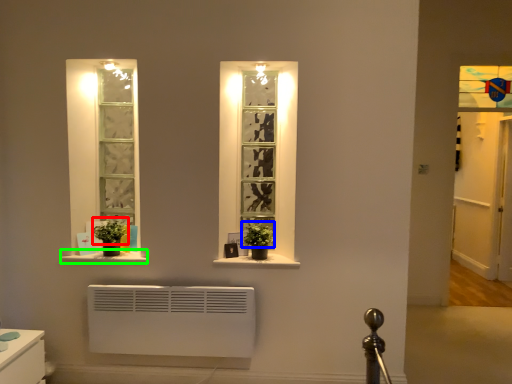
Question: Estimate the real-world distances between objects in this image. Which object is farther from plant (highlighted by a red box), plant (highlighted by a blue box) or window sill (highlighted by a green box)?

Choices:
 (A) plant
 (B) window sill

Answer: (A)